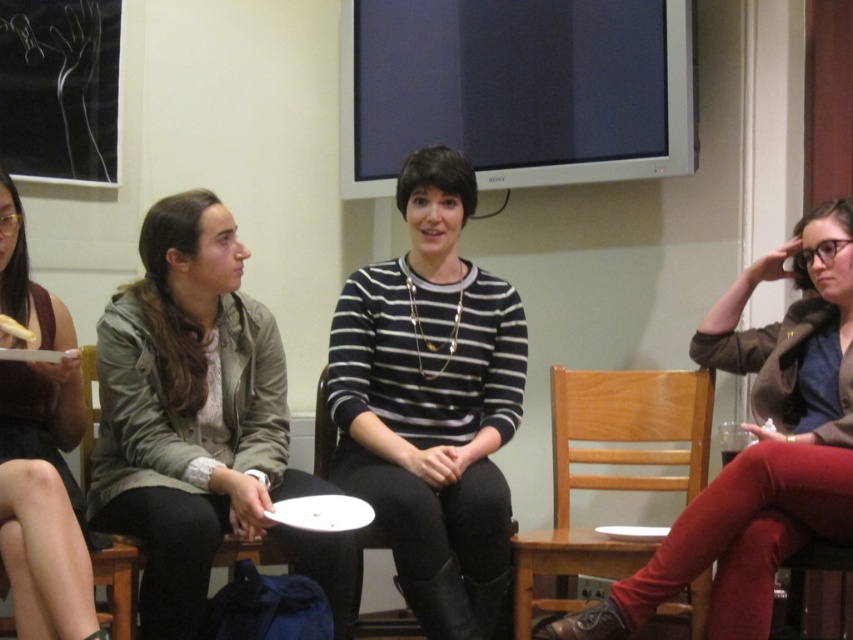
Who is more forward, (x=85, y=577) or (x=561, y=381)?

Point (x=85, y=577)

Who is positioned more to the right, matte black jacket at left or wooden chair at lower center?

wooden chair at lower center is more to the right.

Is point (7, 362) closer to camera compared to point (698, 481)?

Yes, point (7, 362) is closer to viewer.

Identify the location of matte black jacket at left. (39, 452).

Which is behind, point (747, 292) or point (62, 310)?

Positioned behind is point (747, 292).

Is point (572, 625) more distant than point (90, 573)?

Yes.

What do you see at coordinates (759, 445) in the screenshot? I see `velvet red pants at right` at bounding box center [759, 445].

Where is `velvet red pants at right`? The height and width of the screenshot is (640, 853). velvet red pants at right is located at coordinates (759, 445).

Between black leather chair at center and wooden chair at center, which one has less height?

With less height is black leather chair at center.

Who is lower down, black leather chair at center or wooden chair at center?

black leather chair at center is lower down.

This screenshot has width=853, height=640. I want to click on black leather chair at center, so click(322, 429).